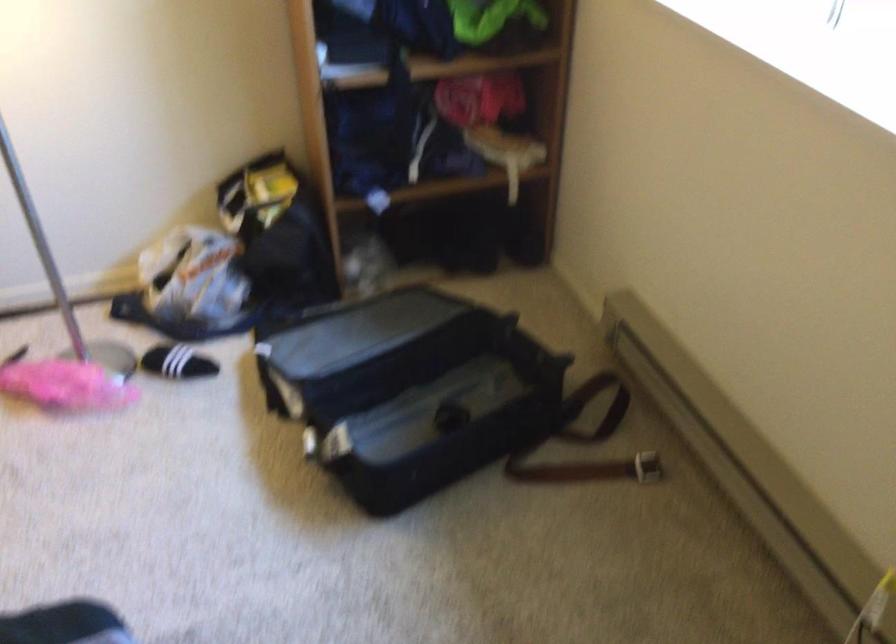
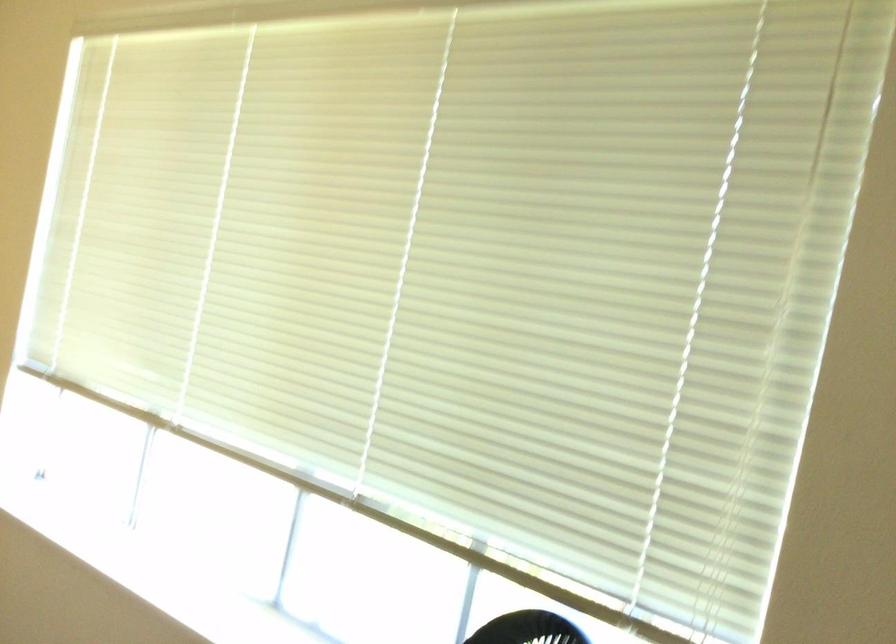
Based on the continuous images, in which direction is the camera rotating?

The camera rotated toward right-up.